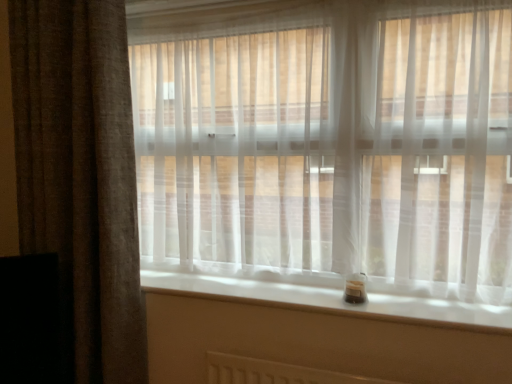
The height and width of the screenshot is (384, 512). I want to click on empty space that is ontop of white smooth window sill at lower center, so click(293, 291).